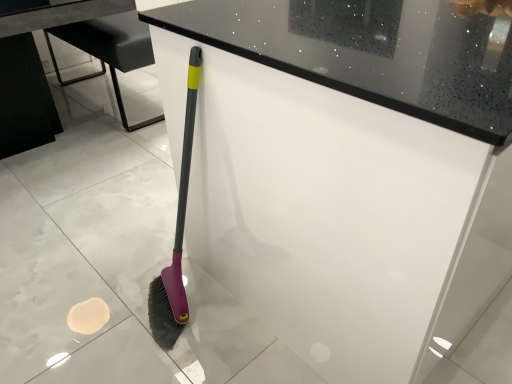
Where is `white glossy counter at center`? white glossy counter at center is located at coordinates (348, 170).

Locate an element on the screen. Image resolution: width=512 pixels, height=384 pixels. white glossy counter at center is located at coordinates (348, 170).

Is white glossy counter at center positioned with its back to metallic gray table at center?

That's not correct — white glossy counter at center is not looking away from metallic gray table at center.

Is white glossy counter at center not within metallic gray table at center?

white glossy counter at center is positioned outside metallic gray table at center.

Does white glossy counter at center appear on the right side of metallic gray table at center?

Correct, you'll find white glossy counter at center to the right of metallic gray table at center.

The image size is (512, 384). Identify the location of furniture above the white glossy counter at center (from the image's perspective). (113, 48).

Could you tell me if metallic gray table at center is facing black glossy table at lower left?

Yes.

Is metallic gray table at center at the right side of black glossy table at lower left?

Yes.

You are a GUI agent. You are given a task and a screenshot of the screen. Output one action in this format:
    pyautogui.click(x=<x>, y=<y>)
    Task: Click on the furniture below the black glossy table at lower left (from a real-world perspective)
    This screenshot has width=512, height=384.
    Given the screenshot: What is the action you would take?
    pyautogui.click(x=113, y=48)

From a real-world perspective, who is located higher, metallic gray table at center or black glossy table at lower left?

black glossy table at lower left.

Is black glossy table at lower left taller than metallic gray table at center?

Correct, black glossy table at lower left is much taller as metallic gray table at center.

Is point (9, 136) positioned behind point (118, 62)?

Yes, it is.

Is metallic gray table at center at the back of black glossy table at lower left?

Yes.

From a real-world perspective, is black glossy table at lower left above or below metallic gray table at center?

From a real-world perspective, black glossy table at lower left is physically above metallic gray table at center.

Is white glossy counter at center oriented away from black glossy table at lower left?

That's not correct — white glossy counter at center is not looking away from black glossy table at lower left.

Visually, is white glossy counter at center positioned to the left or to the right of black glossy table at lower left?

Clearly, white glossy counter at center is on the right of black glossy table at lower left in the image.

Considering the sizes of white glossy counter at center and black glossy table at lower left in the image, is white glossy counter at center taller or shorter than black glossy table at lower left?

white glossy counter at center is taller than black glossy table at lower left.

In the image, is white glossy counter at center positioned in front of or behind black glossy table at lower left?

Clearly, white glossy counter at center is in front of black glossy table at lower left.

Between black glossy table at lower left and white glossy counter at center, which one has more height?

white glossy counter at center.

Is point (42, 79) closer to viewer compared to point (395, 373)?

No, (42, 79) is further to viewer.

Find the location of a particular element. The image size is (512, 384). table above the white glossy counter at center (from the image's perspective) is located at coordinates (34, 68).

How many degrees apart are the facing directions of black glossy table at lower left and white glossy counter at center?

There is a 92.3-degree angle between the facing directions of black glossy table at lower left and white glossy counter at center.

Considering the sizes of objects metallic gray table at center and white glossy counter at center in the image provided, who is thinner, metallic gray table at center or white glossy counter at center?

Thinner between the two is metallic gray table at center.

Which point is more forward, (146, 28) or (196, 229)?

The point (196, 229) is closer.

In terms of size, does metallic gray table at center appear bigger or smaller than white glossy counter at center?

Considering their sizes, metallic gray table at center takes up less space than white glossy counter at center.

Where is `furniture lying above the white glossy counter at center (from the image's perspective)`? This screenshot has width=512, height=384. furniture lying above the white glossy counter at center (from the image's perspective) is located at coordinates (113, 48).

This screenshot has height=384, width=512. Find the location of `table above the metallic gray table at center (from a real-world perspective)`. table above the metallic gray table at center (from a real-world perspective) is located at coordinates (34, 68).

Based on their spatial positions, is metallic gray table at center or black glossy table at lower left further from white glossy counter at center?

black glossy table at lower left lies further to white glossy counter at center than the other object.

Estimate the real-world distances between objects in this image. Which object is closer to black glossy table at lower left, white glossy counter at center or metallic gray table at center?

The object closer to black glossy table at lower left is metallic gray table at center.

Looking at the image, which one is located further to black glossy table at lower left, metallic gray table at center or white glossy counter at center?

white glossy counter at center is positioned further to the anchor black glossy table at lower left.

From the image, which object appears to be farther from metallic gray table at center, black glossy table at lower left or white glossy counter at center?

white glossy counter at center is positioned further to the anchor metallic gray table at center.

Considering their positions, is black glossy table at lower left positioned further to white glossy counter at center than metallic gray table at center?

The object further to white glossy counter at center is black glossy table at lower left.

Which object lies further to the anchor point metallic gray table at center, white glossy counter at center or black glossy table at lower left?

Among the two, white glossy counter at center is located further to metallic gray table at center.

Where is `furniture located between black glossy table at lower left and white glossy counter at center in the left-right direction`? Image resolution: width=512 pixels, height=384 pixels. furniture located between black glossy table at lower left and white glossy counter at center in the left-right direction is located at coordinates (113, 48).